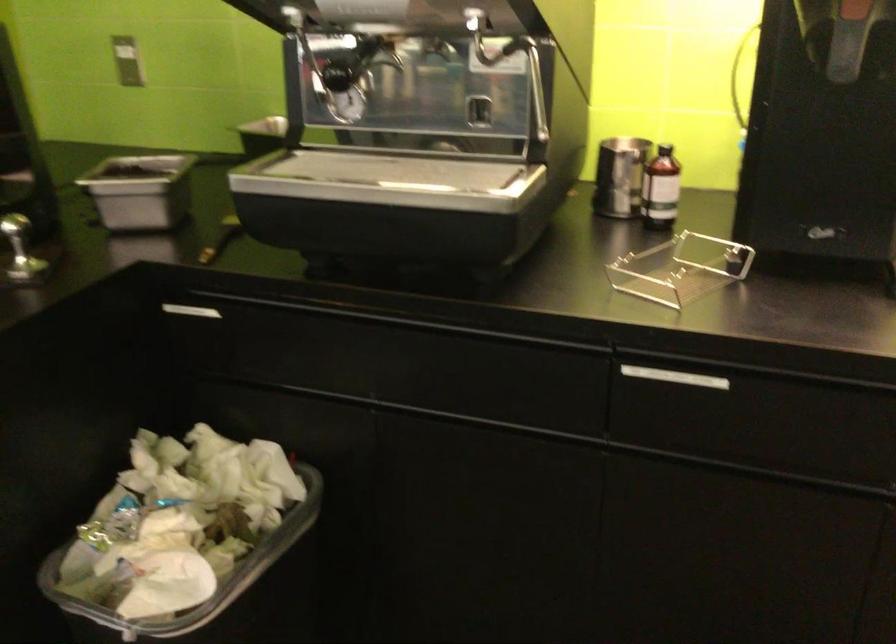
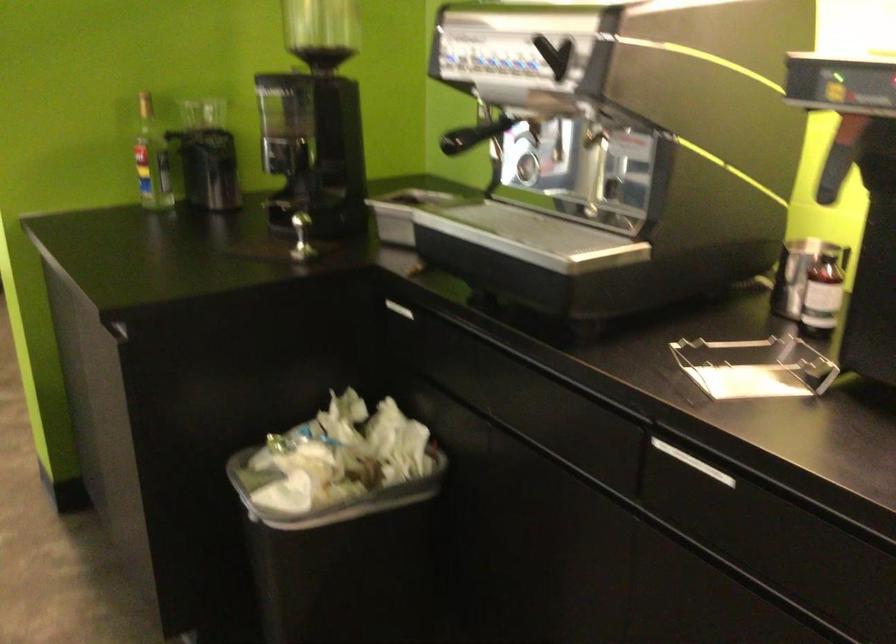
Where in the second image is the point corresponding to point 674,377 from the first image?

(693, 462)